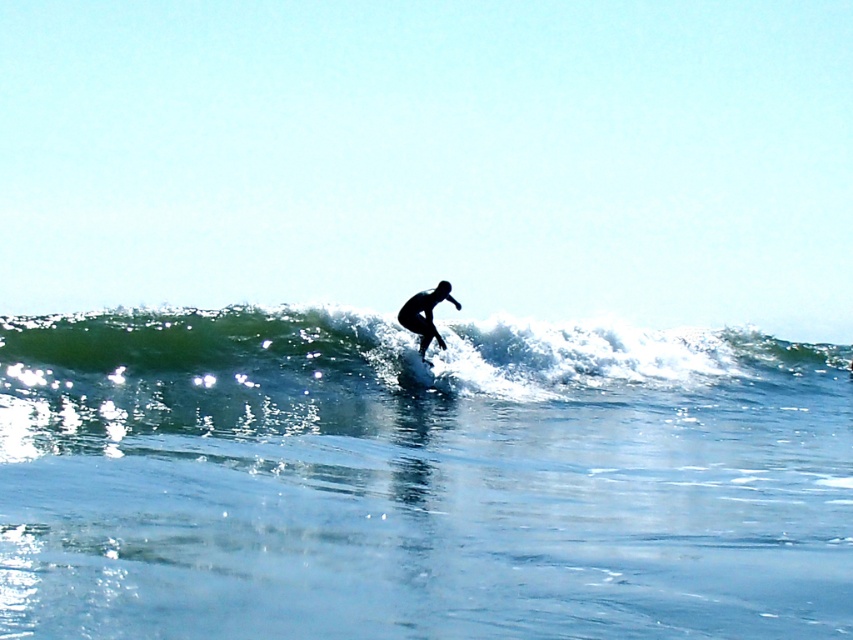
You are a drone operator trying to capture the surfer riding the wave. The surfer is currently at the peak of the wave. You need to adjust your drone to focus on the clear blue water at wave center located at point [418,477]. Is the point where the surfer is located closer to the top or bottom of the image?

The point where the surfer is located is at the peak of the wave. Since the wave is mid break with white foam cresting at its peak, the peak is the highest point of the wave. The clear blue water at wave center at point [418,477] is located at the center of the wave. In typical wave structure, the center of the wave is lower than the peak. Therefore, the surfer at the peak would be closer to the top of the image compared to the clear blue water at wave center.

You are a photographer trying to capture the surfer and their surfboard in a way that shows the wave beneath them. Based on the scene, can you position yourself so that the black matte surfboard at center is above the green rubber wave at center in the photo?

Yes, since the green rubber wave at center is located below the black matte surfboard at center, positioning yourself to capture the scene from above or maintaining the natural perspective will ensure the black matte surfboard at center appears above the green rubber wave at center in the photo.